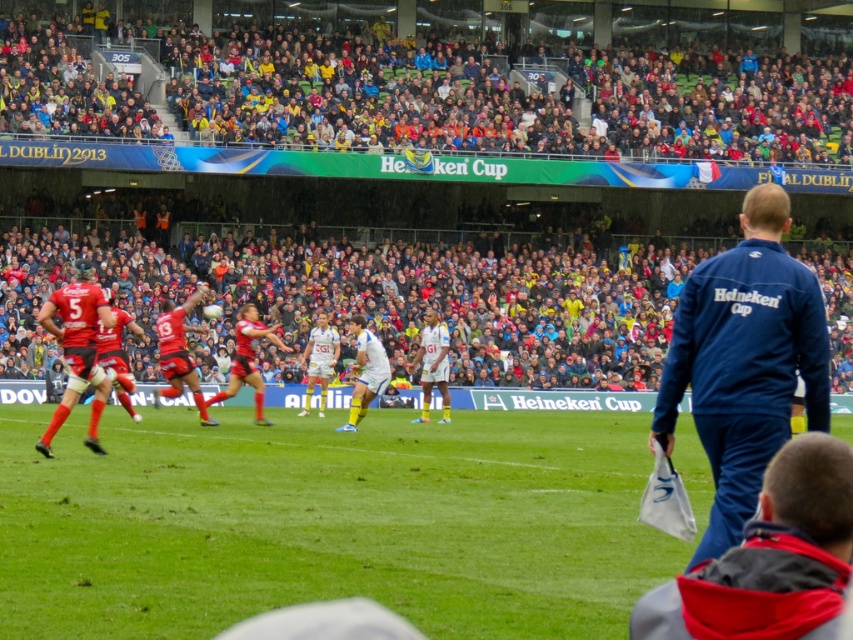
You are a photographer standing at the edge of the rugby field. You want to capture a photo of the red jersey at center without the multicolored fabric seats at upper center overlapping it. Is the width of the seats wider than the jersey?

The multicolored fabric seats at upper center are wider than the red jersey at center, so yes, the seats are wider. Position yourself or adjust your angle to avoid overlap.

You are a photographer standing at the edge of the rugby field. You want to take a photo of both the blue fabric jacket at right and the blue fabric jacket at lower right. Which jacket will appear larger in your photo?

The blue fabric jacket at right is closer to the viewer than the blue fabric jacket at lower right, so it will appear larger in the photo.

You are a sports analyst observing the rugby match. You notice two items of clothing in the scene. The blue fabric jacket at lower right and the red jersey at center. Which one appears to be thinner in material?

The blue fabric jacket at lower right is thinner than the red jersey at center.